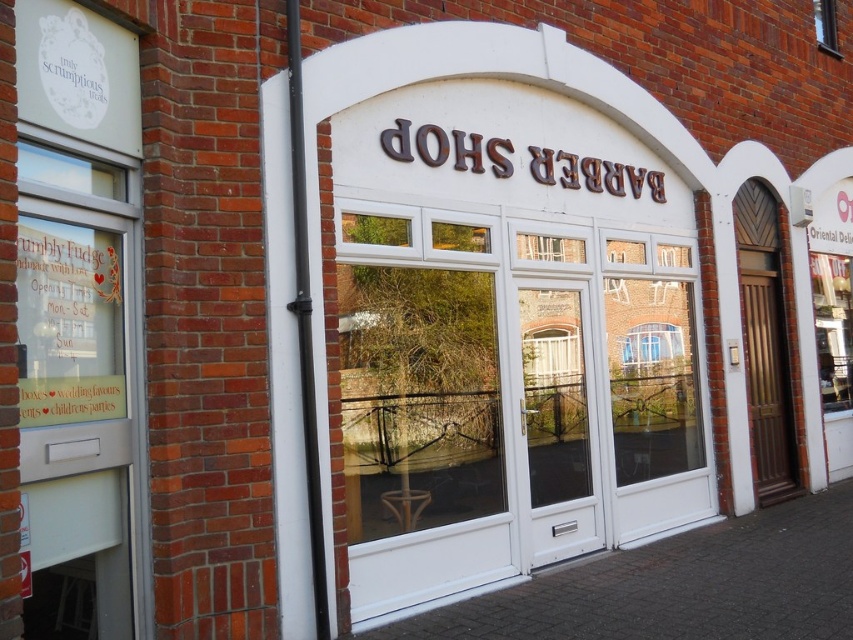
Question: Does brown wooden door at right appear under transparent glass window at upper right?

Choices:
 (A) no
 (B) yes

Answer: (B)

Question: Does brown wooden door at right have a lesser width compared to transparent glass window at upper right?

Choices:
 (A) yes
 (B) no

Answer: (B)

Question: Which point appears farthest from the camera in this image?

Choices:
 (A) [828, 0]
 (B) [756, 376]

Answer: (A)

Question: Is brown wooden door at right further to the viewer compared to transparent glass window at upper right?

Choices:
 (A) yes
 (B) no

Answer: (B)